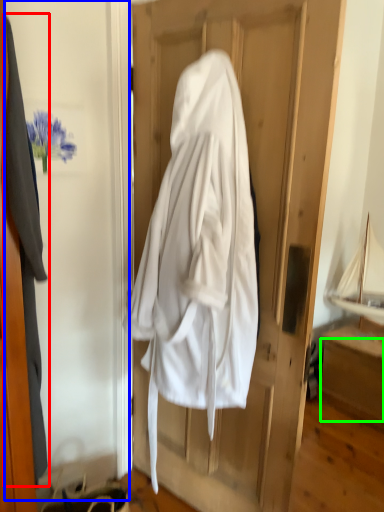
Question: Based on their relative distances, which object is farther from garment (highlighted by a red box)? Choose from screen door (highlighted by a blue box) and drawer (highlighted by a green box).

Choices:
 (A) screen door
 (B) drawer

Answer: (B)